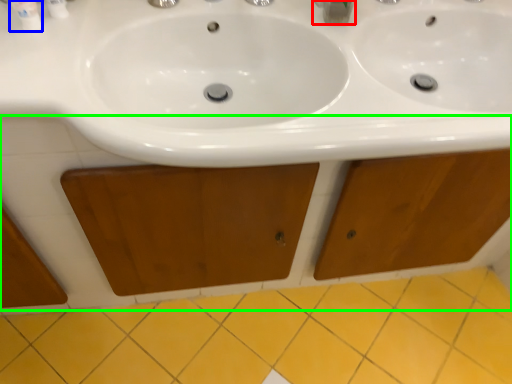
Question: Estimate the real-world distances between objects in this image. Which object is farther from plumbing fixture (highlighted by a red box), mouthwash (highlighted by a blue box) or cabinetry (highlighted by a green box)?

Choices:
 (A) mouthwash
 (B) cabinetry

Answer: (B)